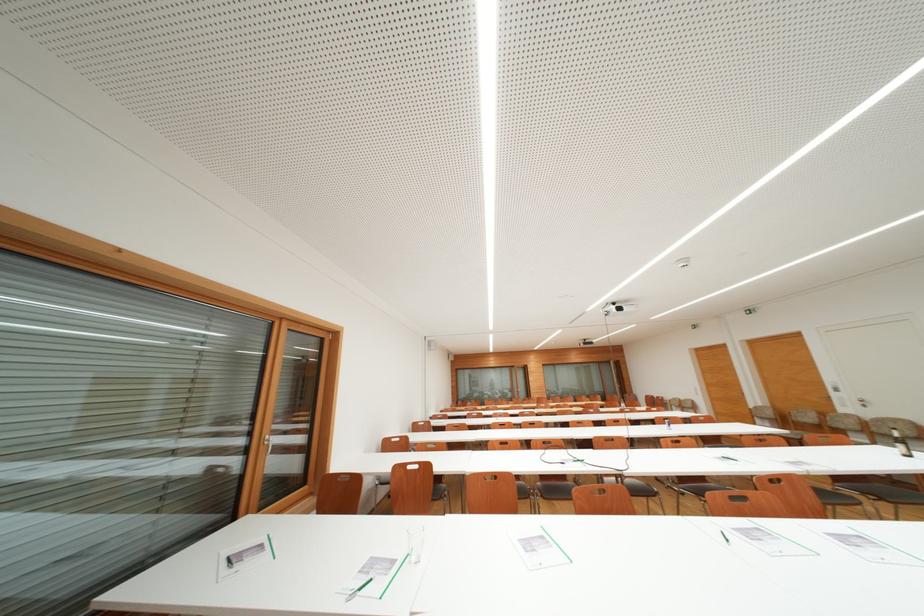
Where would you sit the wooden chair sitting surface? Please return your answer as a coordinate pair (x, y).

(395, 444)